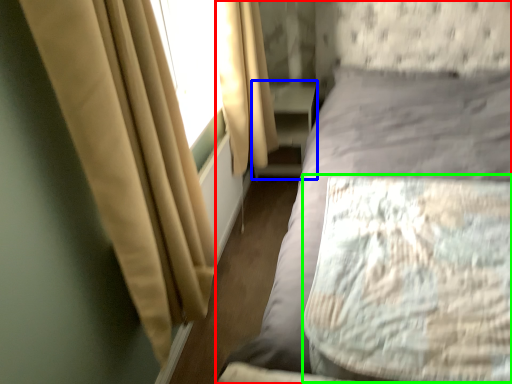
Question: Which object is positioned closest to bed (highlighted by a red box)? Select from dresser (highlighted by a blue box) and mattress (highlighted by a green box).

Choices:
 (A) dresser
 (B) mattress

Answer: (B)